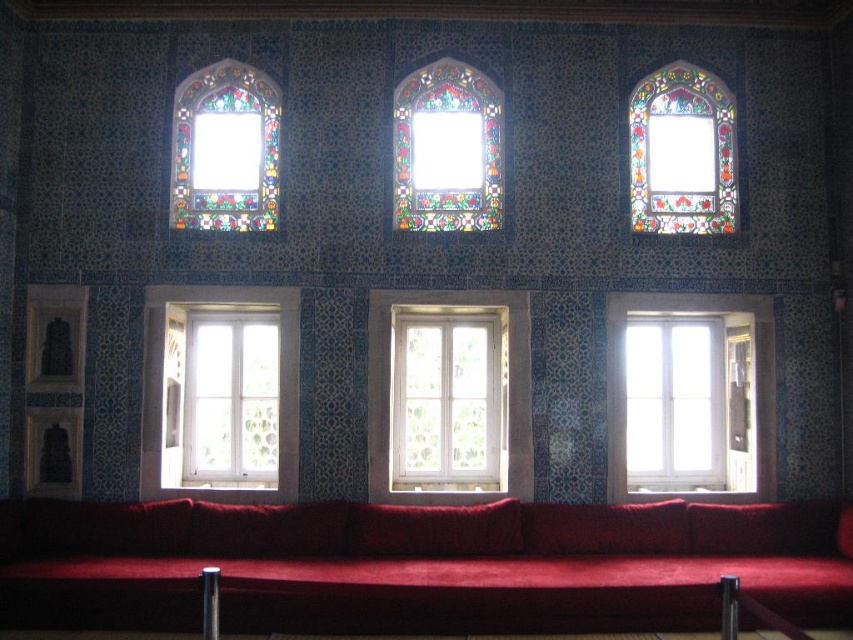
You are an interior designer planning to install a new lighting fixture. You have two options based on the existing stained glass windows. The first option is a wide fixture that matches the width of the stained glass window at upper right. The second is a narrower one matching the stained glass window at center. Which option would you choose if you want the fixture to be wider?

The stained glass window at upper right is wider than the stained glass window at center, so choosing the first option that matches the stained glass window at upper right would result in a wider fixture.

You are an interior designer planning to install a new decorative element between the stained glass window at center and the stained glass window at upper right. Based on their positions, which window should the new element be placed closer to?

The stained glass window at center is positioned over the stained glass window at upper right, so the new decorative element should be placed closer to the stained glass window at upper right since it is below the center window.

You are an interior designer planning to install a new light fixture. You have two options in front of you, one that requires mounting behind the white wooden window at center and another that needs to be placed in front of the white glass window at left. Based on the scene description, which option is feasible?

The white glass window at left is behind the white wooden window at center, so mounting behind the white wooden window at center would not be possible since the white glass window at left is already there. The feasible option is to place the light fixture in front of the white glass window at left.